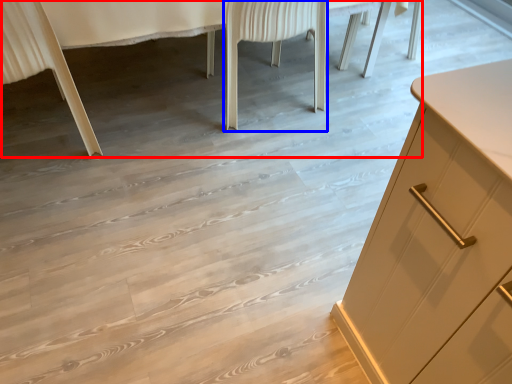
Question: Among these objects, which one is farthest to the camera, vanity (highlighted by a red box) or chair (highlighted by a blue box)?

Choices:
 (A) vanity
 (B) chair

Answer: (B)